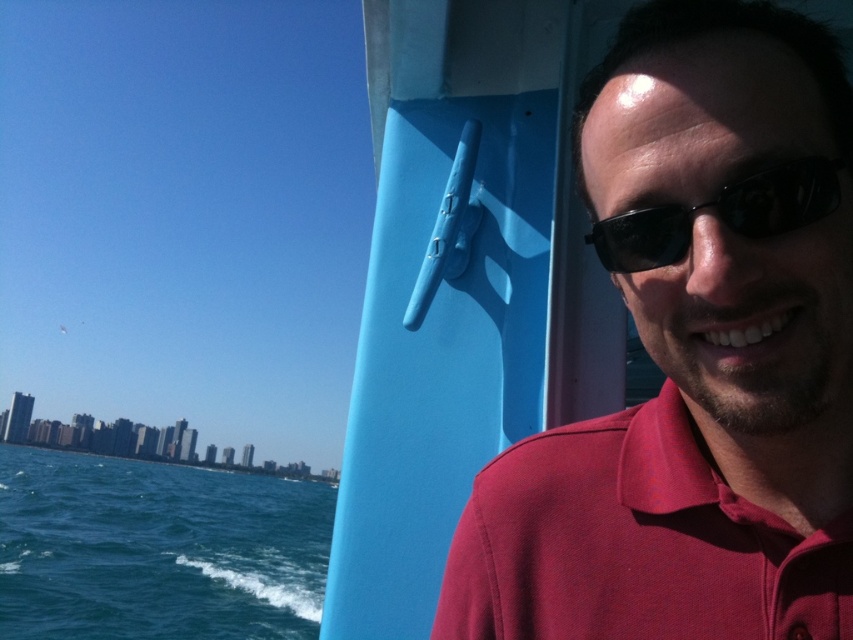
Between point (827, 614) and point (82, 541), which one is positioned in front?

Point (827, 614) is more forward.

Is matte red polo shirt at right smaller than blue liquid water at lower left?

Indeed, matte red polo shirt at right has a smaller size compared to blue liquid water at lower left.

Where is `matte red polo shirt at right`? This screenshot has width=853, height=640. matte red polo shirt at right is located at coordinates (634, 544).

Does matte red shirt at right appear over blue liquid water at lower left?

Indeed, matte red shirt at right is positioned over blue liquid water at lower left.

Between matte red shirt at right and blue liquid water at lower left, which one is positioned higher?

Positioned higher is matte red shirt at right.

The height and width of the screenshot is (640, 853). In order to click on matte red shirt at right in this screenshot , I will do `click(694, 355)`.

I want to click on blue liquid water at lower left, so click(x=155, y=550).

Which is in front, point (53, 529) or point (735, 198)?

Positioned in front is point (735, 198).

Find the location of a particular element. The image size is (853, 640). blue liquid water at lower left is located at coordinates (155, 550).